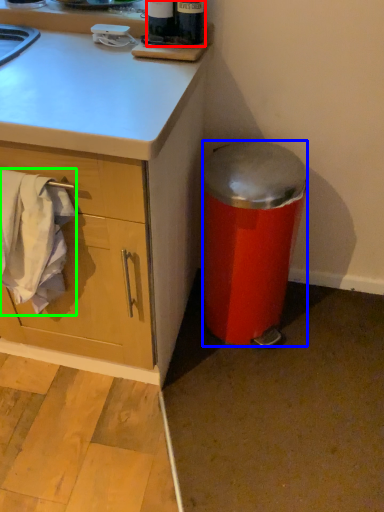
Question: Considering the real-world distances, which object is farthest from bottle (highlighted by a red box)? trash bin/can (highlighted by a blue box) or laundry (highlighted by a green box)?

Choices:
 (A) trash bin/can
 (B) laundry

Answer: (B)